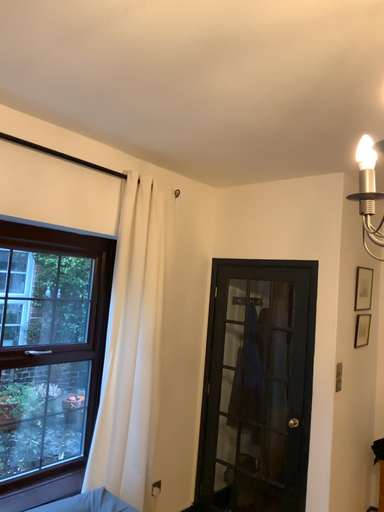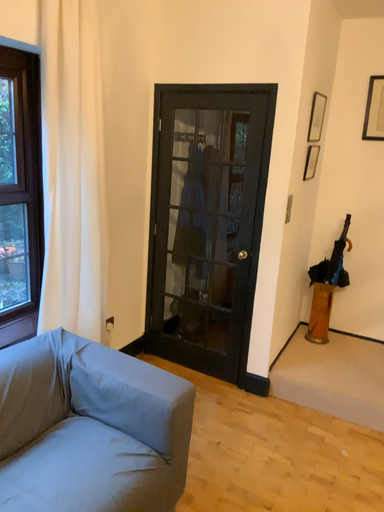
Question: How did the camera likely rotate when shooting the video?

Choices:
 (A) rotated downward
 (B) rotated upward

Answer: (A)